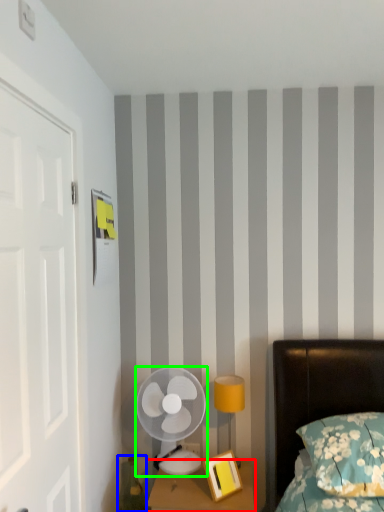
Question: Which object is the farthest from nightstand (highlighted by a red box)? Choose among these: teal (highlighted by a blue box) or mechanical fan (highlighted by a green box).

Choices:
 (A) teal
 (B) mechanical fan

Answer: (A)